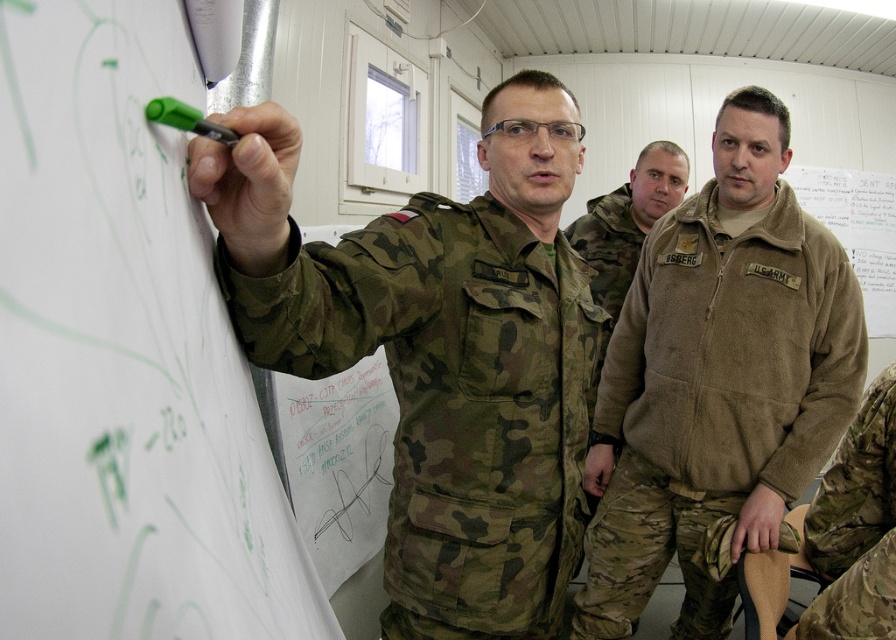
In the military training scene, there are two camouflage items visible. The camouflage fabric pants at lower right and the camouflage fabric jacket at center. Which of these two items takes up more visual space in the image?

The camouflage fabric jacket at center takes up more visual space than the camouflage fabric pants at lower right because the camouflage fabric pants at lower right occupies less space than camouflage fabric jacket at center.